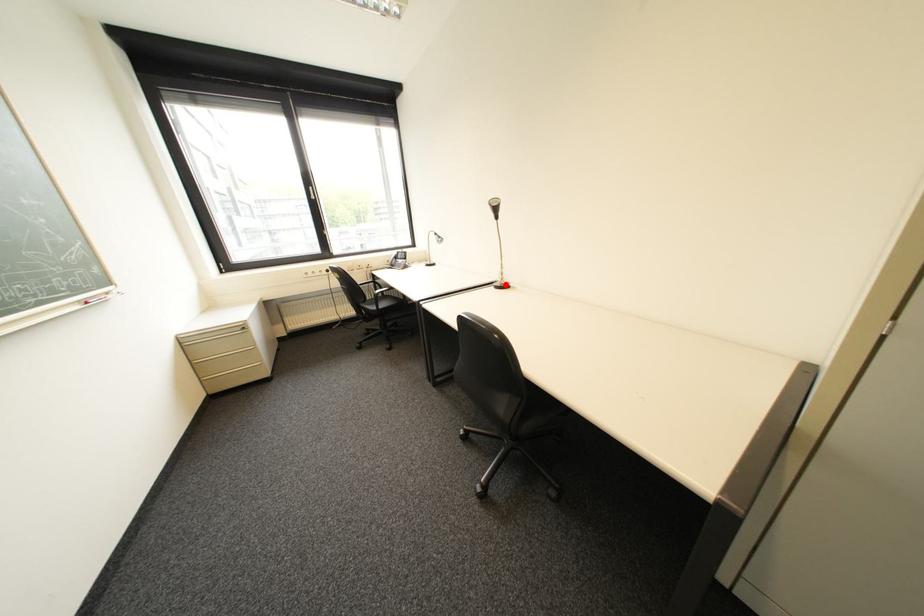
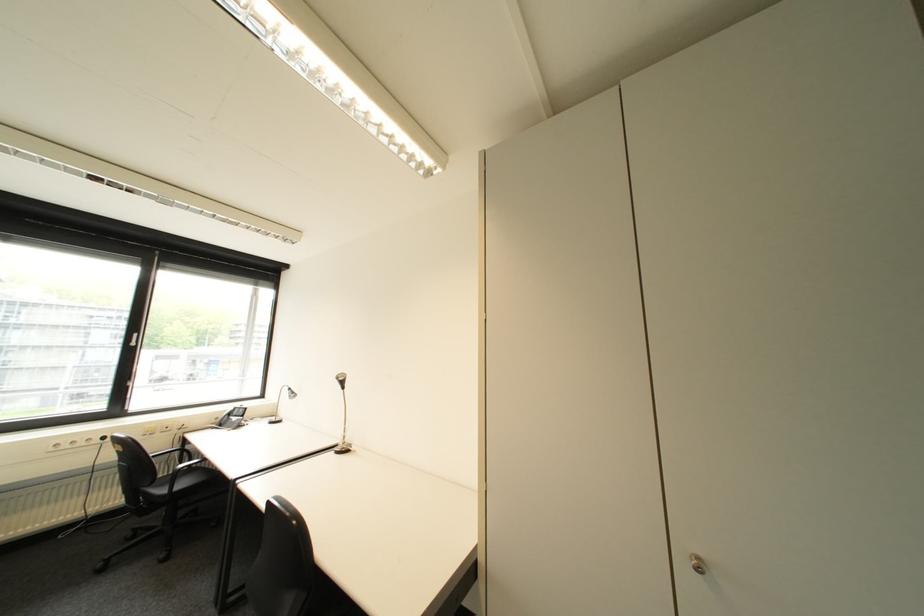
In the second image, find the point that corresponds to the highlighted location in the first image.

(346, 450)